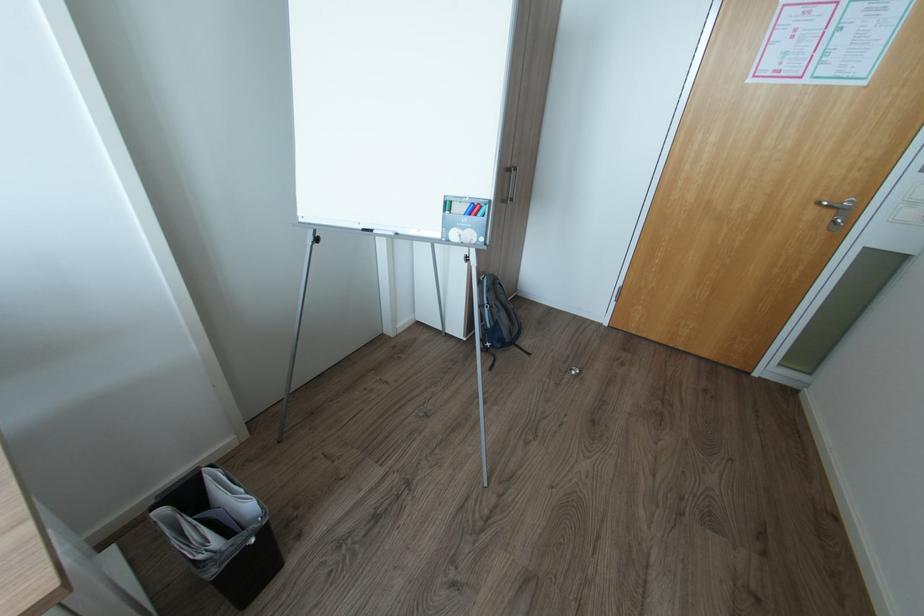
Where is `vertical cabinet handle`? vertical cabinet handle is located at coordinates (509, 184).